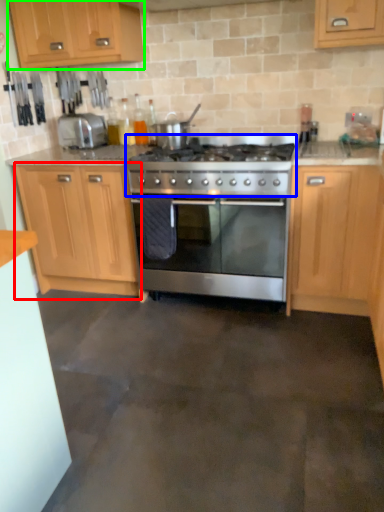
Question: Which object is positioned closest to cabinetry (highlighted by a red box)? Select from gas stove (highlighted by a blue box) and cabinetry (highlighted by a green box).

Choices:
 (A) gas stove
 (B) cabinetry

Answer: (A)